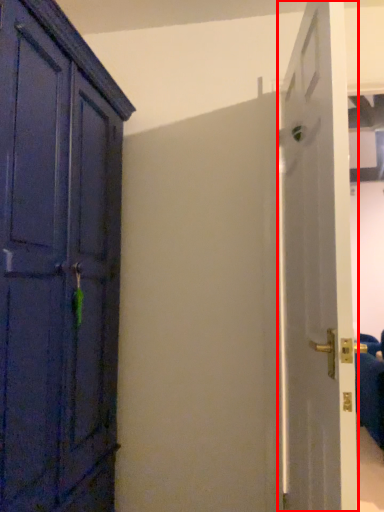
Question: In this image, where is door (annotated by the red box) located relative to furniture?

Choices:
 (A) left
 (B) right

Answer: (A)